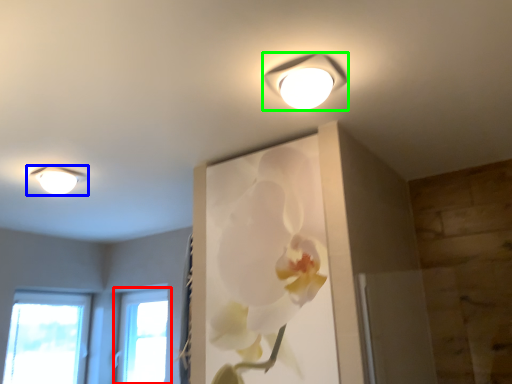
Question: Estimate the real-world distances between objects in this image. Which object is closer to window (highlighted by a red box), lamp (highlighted by a blue box) or lamp (highlighted by a green box)?

Choices:
 (A) lamp
 (B) lamp

Answer: (A)